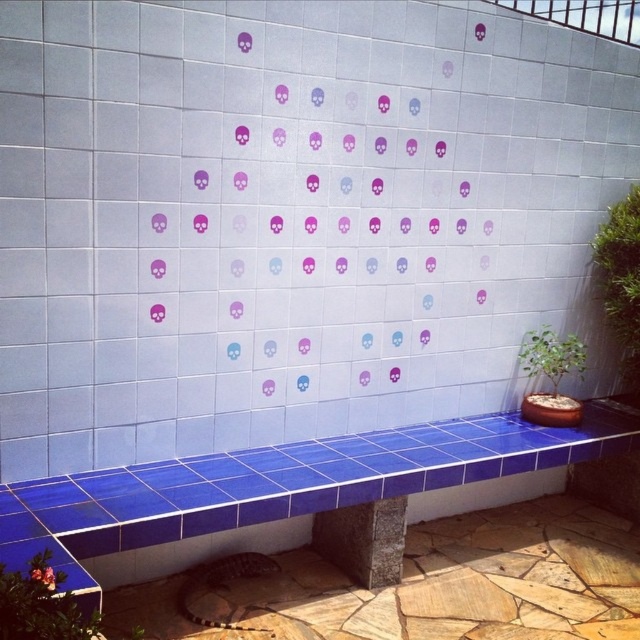
Does point (161, 488) come farther from viewer compared to point (86, 630)?

Yes, point (161, 488) is farther from viewer.

Is blue ceramic bench at center smaller than green leafy plant at lower left?

No, blue ceramic bench at center is not smaller than green leafy plant at lower left.

The height and width of the screenshot is (640, 640). Describe the element at coordinates (280, 483) in the screenshot. I see `blue ceramic bench at center` at that location.

Where is `blue ceramic bench at center`? blue ceramic bench at center is located at coordinates (280, 483).